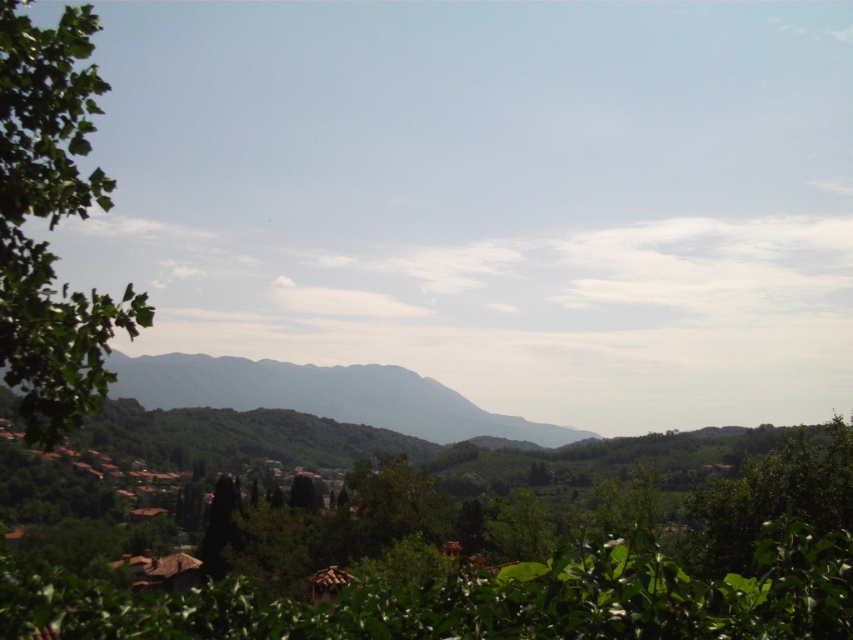
Between green leafy tree at center and green leafy tree at left, which one appears on the right side from the viewer's perspective?

green leafy tree at center

The width and height of the screenshot is (853, 640). What do you see at coordinates (486, 598) in the screenshot?
I see `green leafy tree at center` at bounding box center [486, 598].

Does point (840, 541) come farther from viewer compared to point (84, 410)?

Yes, it is behind point (84, 410).

The image size is (853, 640). Identify the location of green leafy tree at center. (x=486, y=598).

Can you confirm if green leafy tree at center is bigger than green textured mountain at center?

No.

Does point (802, 634) come closer to viewer compared to point (447, 417)?

Yes, it is.

Locate an element on the screen. The image size is (853, 640). green leafy tree at center is located at coordinates (486, 598).

Which is below, green leafy tree at left or green textured mountain at center?

green textured mountain at center is below.

Is green leafy tree at left to the left of green textured mountain at center from the viewer's perspective?

Incorrect, green leafy tree at left is not on the left side of green textured mountain at center.

At what (x,y) coordinates should I click in order to perform the action: click on green leafy tree at left. Please return your answer as a coordinate pair (x, y). Looking at the image, I should click on (51, 221).